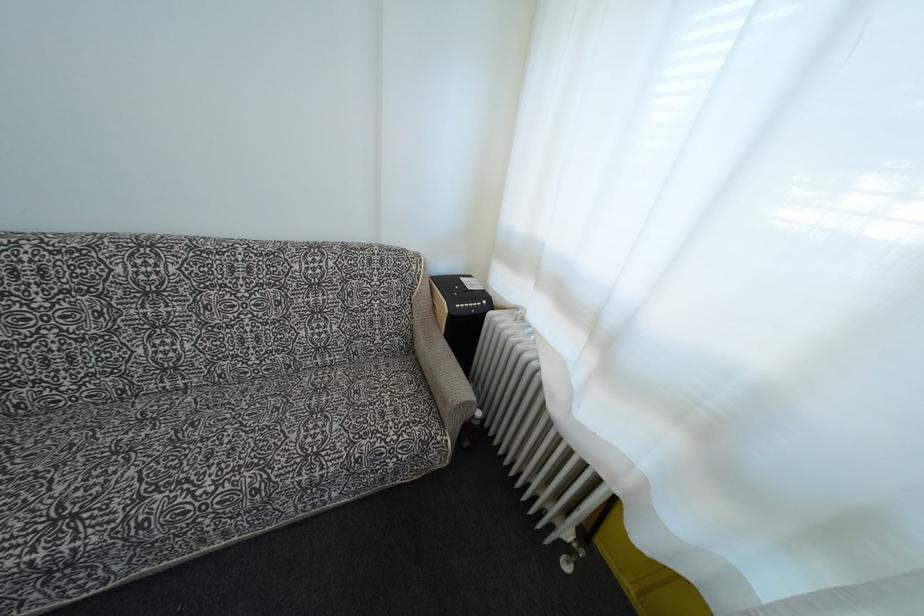
The image size is (924, 616). Identify the location of sofa sitting surface. (235, 440).